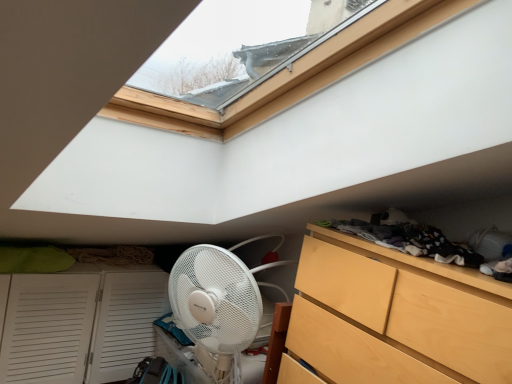
Question: Is light wood dresser at lower right at the right side of dark gray fabric at upper right?

Choices:
 (A) yes
 (B) no

Answer: (B)

Question: From the image's perspective, would you say light wood dresser at lower right is positioned over dark gray fabric at upper right?

Choices:
 (A) no
 (B) yes

Answer: (A)

Question: Does light wood dresser at lower right have a lesser width compared to dark gray fabric at upper right?

Choices:
 (A) yes
 (B) no

Answer: (B)

Question: Can you confirm if light wood dresser at lower right is wider than dark gray fabric at upper right?

Choices:
 (A) yes
 (B) no

Answer: (A)

Question: Is the depth of light wood dresser at lower right greater than that of dark gray fabric at upper right?

Choices:
 (A) no
 (B) yes

Answer: (A)

Question: Could you tell me if light wood dresser at lower right is facing dark gray fabric at upper right?

Choices:
 (A) yes
 (B) no

Answer: (B)

Question: From the image's perspective, is dark gray fabric at upper right below white louvered cupboard at lower left?

Choices:
 (A) no
 (B) yes

Answer: (A)

Question: Would you say dark gray fabric at upper right is outside white louvered cupboard at lower left?

Choices:
 (A) yes
 (B) no

Answer: (A)

Question: Can you confirm if dark gray fabric at upper right is bigger than white louvered cupboard at lower left?

Choices:
 (A) yes
 (B) no

Answer: (B)

Question: Is dark gray fabric at upper right facing away from white louvered cupboard at lower left?

Choices:
 (A) no
 (B) yes

Answer: (A)

Question: Is dark gray fabric at upper right closer to camera compared to white louvered cupboard at lower left?

Choices:
 (A) no
 (B) yes

Answer: (B)

Question: From the image's perspective, is dark gray fabric at upper right over white louvered cupboard at lower left?

Choices:
 (A) yes
 (B) no

Answer: (A)

Question: Is dark gray fabric at upper right at the right side of light wood dresser at lower right?

Choices:
 (A) no
 (B) yes

Answer: (B)